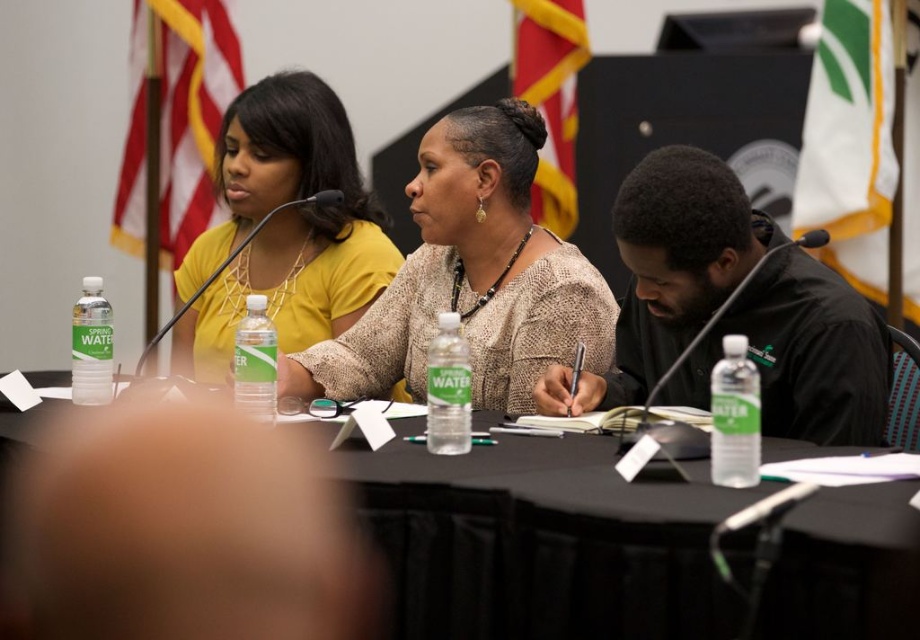
Question: Is beige textured sweater at center smaller than clear plastic water bottle at lower left?

Choices:
 (A) yes
 (B) no

Answer: (B)

Question: Which point appears farthest from the camera in this image?

Choices:
 (A) (858, 563)
 (B) (330, 291)

Answer: (B)

Question: Observing the image, what is the correct spatial positioning of clear plastic water bottle at right in reference to clear plastic water bottle at lower left?

Choices:
 (A) left
 (B) right

Answer: (B)

Question: Among these objects, which one is farthest from the camera?

Choices:
 (A) black fabric table at center
 (B) matte yellow shirt at upper left
 (C) beige textured sweater at center

Answer: (B)

Question: Which object appears closest to the camera in this image?

Choices:
 (A) clear plastic water bottle at right
 (B) black fabric table at center

Answer: (B)

Question: Does clear plastic water bottle at center appear on the left side of clear plastic bottle at center?

Choices:
 (A) yes
 (B) no

Answer: (B)